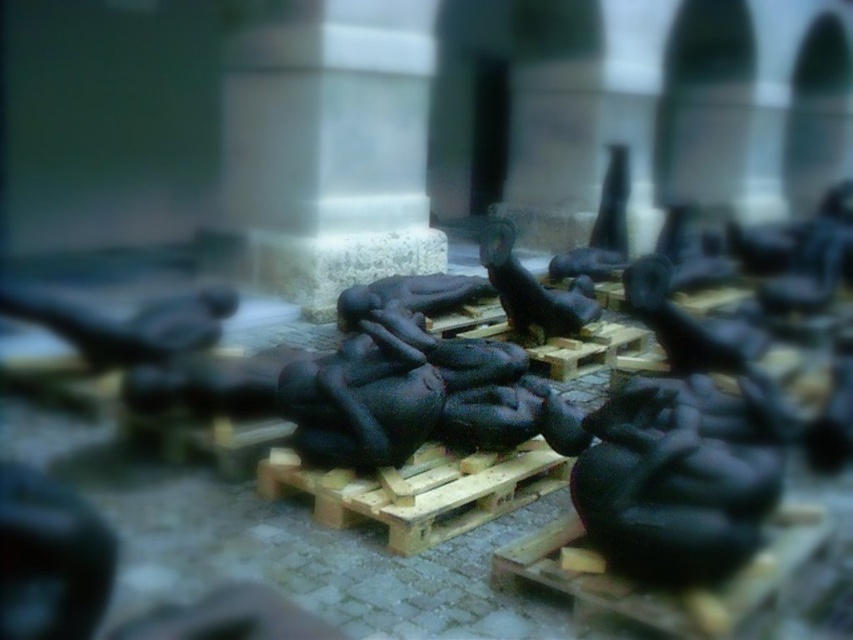
You are standing at the origin point of a coordinate system where the bottom left corner of the image is the origin. You want to locate the matte black sculpture at center. What are its coordinates?

The coordinates of the matte black sculpture at center are at point (x=532, y=289).

You are an art curator planning to move the matte black sculpture at center and the black rubber sculpture at center to a new exhibition space. If you want to maintain the original spatial relationship between them, which sculpture should be placed to the left of the other?

The matte black sculpture at center should be placed to the left of the black rubber sculpture at center to maintain their original spatial relationship.

You are an art curator planning to display the matte black sculpture at center and the black rubber sculpture at center in a gallery. Given their sizes, which sculpture should be placed on the lower pedestal to ensure proper visual balance?

The matte black sculpture at center is smaller than the black rubber sculpture at center, so placing the smaller matte black sculpture at center on the lower pedestal would create a balanced composition by compensating for its size with a lower position.